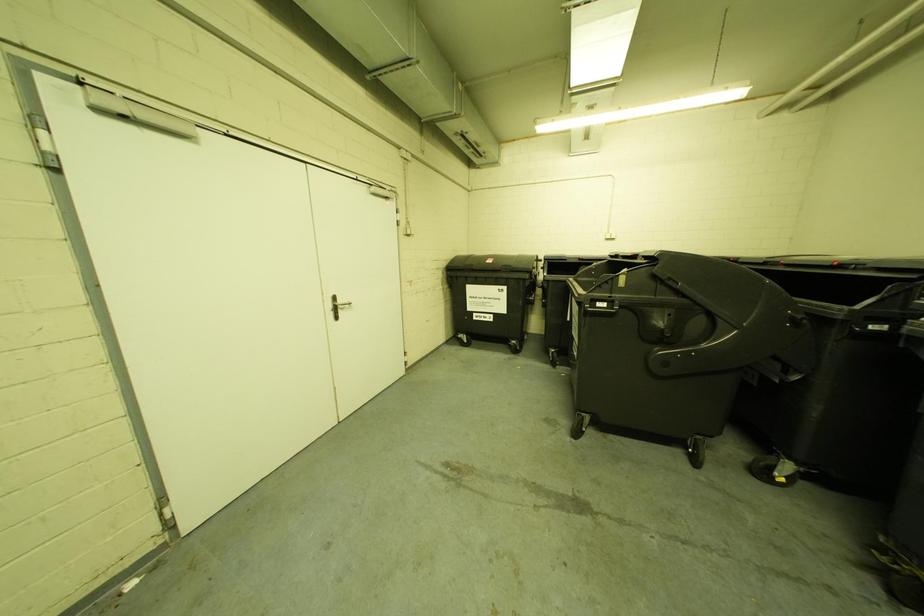
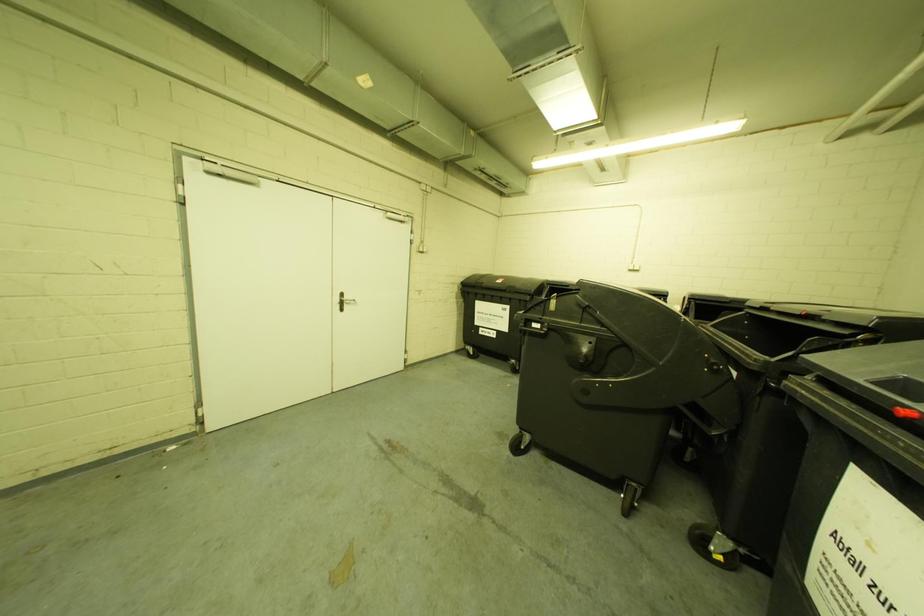
Question: Based on the continuous images, in which direction is the camera rotating? Reply with the corresponding letter.

Choices:
 (A) Left
 (B) Right
 (C) Up
 (D) Down

Answer: (A)